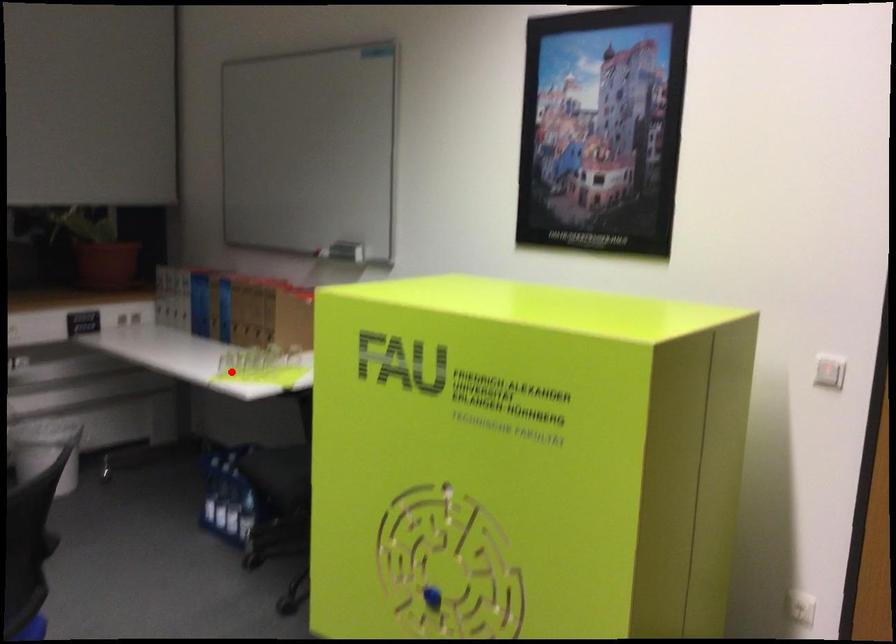
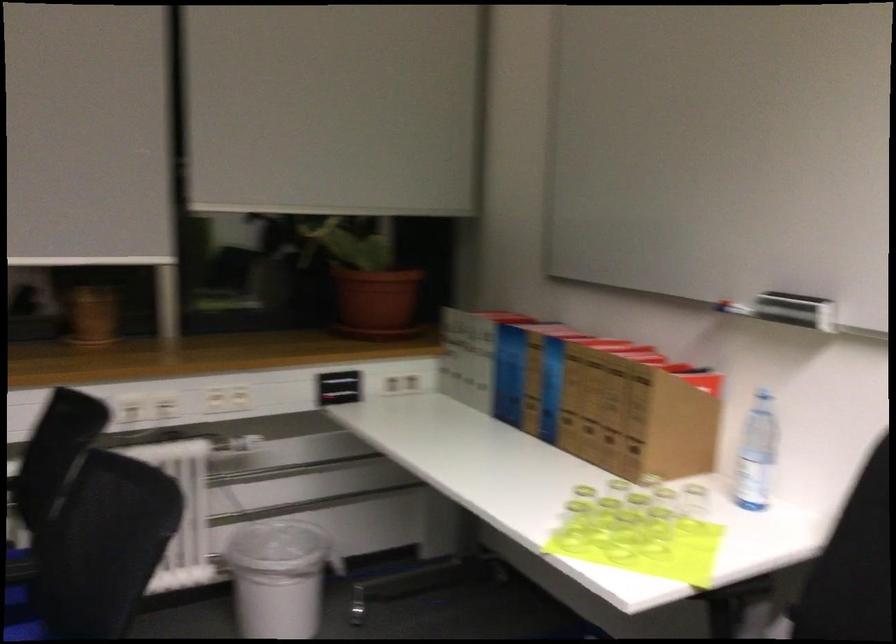
Question: A red point is marked in image1. In image2, is the corresponding 3D point closer to the camera or farther? Reply with the corresponding letter.

Choices:
 (A) The corresponding 3D point is closer.
 (B) The corresponding 3D point is farther.

Answer: (A)